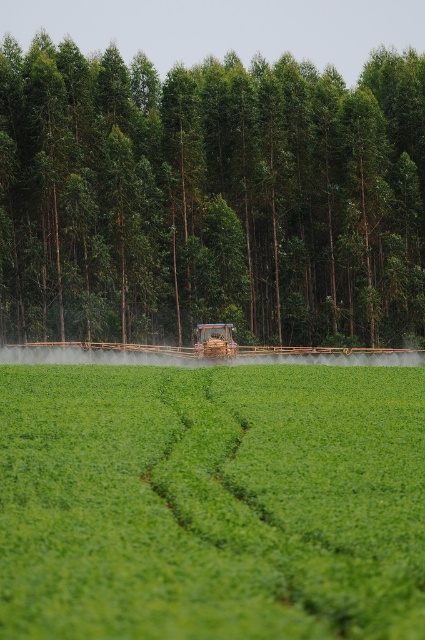
Based on the scene description, where is the green leafy field at center located in terms of its 2D coordinates?

The green leafy field at center is located at the 2D coordinates point of (212, 502).

You are a farmer checking the field from the tractor. You notice a green leafy tree at center and a wooden brown tractor at center. Which object is larger in size?

The green leafy tree at center is bigger than the wooden brown tractor at center.